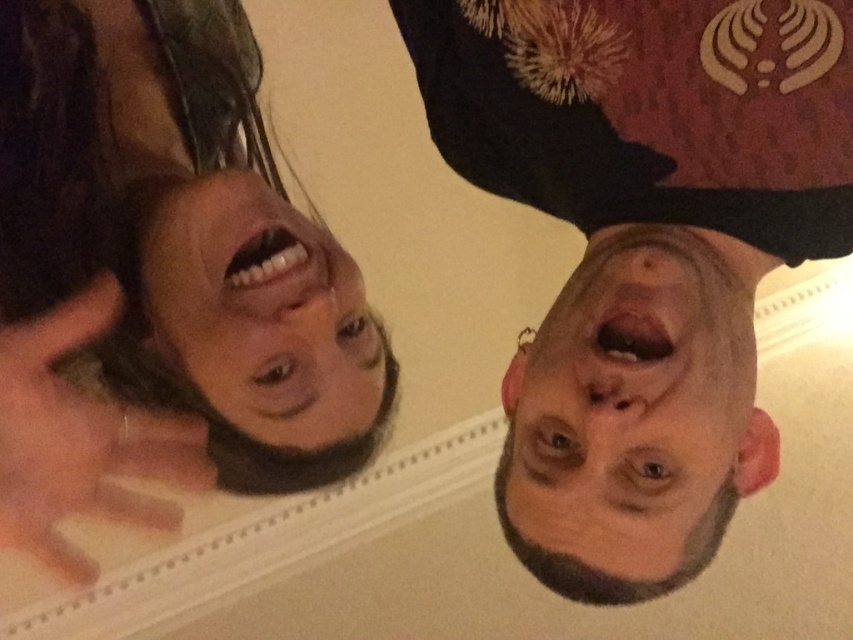
Question: Among these points, which one is farthest from the camera?

Choices:
 (A) (606, 310)
 (B) (769, 12)
 (C) (57, 545)
 (D) (234, 317)

Answer: (C)

Question: Is dark brown hair at upper left positioned before bald head at lower right?

Choices:
 (A) no
 (B) yes

Answer: (B)

Question: Which object is closer to the camera taking this photo?

Choices:
 (A) smooth skin face at upper left
 (B) dark brown hair at upper right

Answer: (B)

Question: Which object is farther from the camera taking this photo?

Choices:
 (A) bald head at lower right
 (B) dark brown hair at upper left

Answer: (A)

Question: From the image, what is the correct spatial relationship of dark brown hair at upper left in relation to smooth skin face at upper left?

Choices:
 (A) above
 (B) below

Answer: (A)

Question: Observing the image, what is the correct spatial positioning of dark brown hair at upper right in reference to smooth skin face at upper left?

Choices:
 (A) left
 (B) right

Answer: (B)